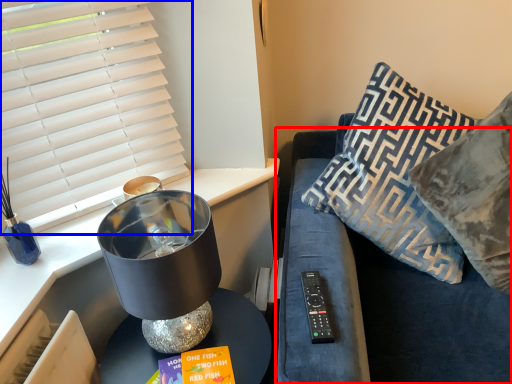
Question: Which object appears farthest to the camera in this image, couch (highlighted by a red box) or window blind (highlighted by a blue box)?

Choices:
 (A) couch
 (B) window blind

Answer: (B)